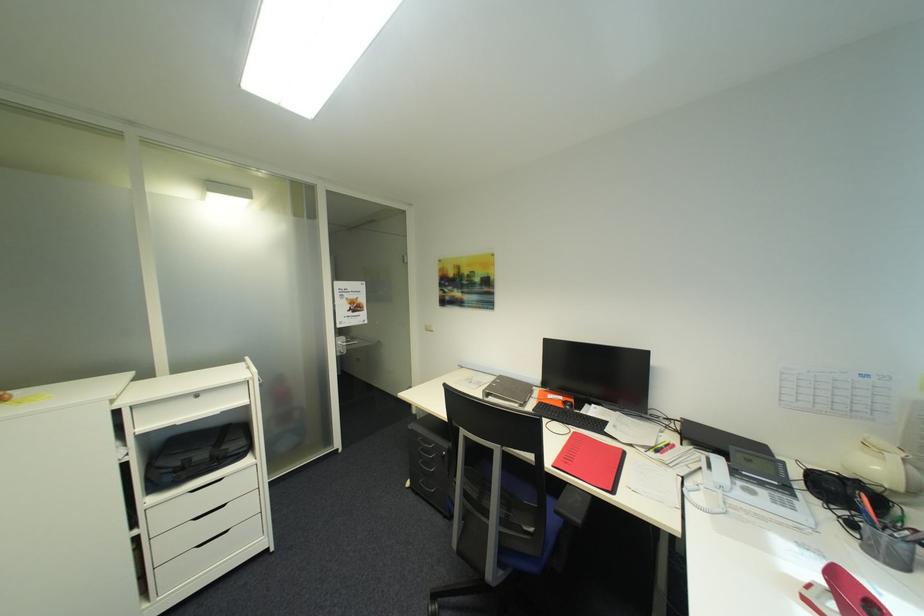
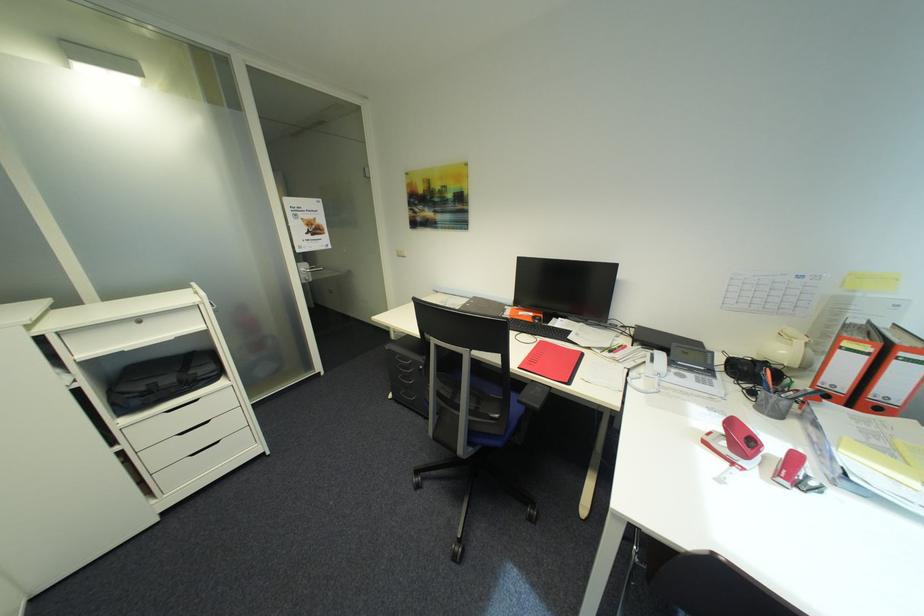
In the second image, find the point that corresponds to (x=496, y=519) in the first image.

(467, 411)